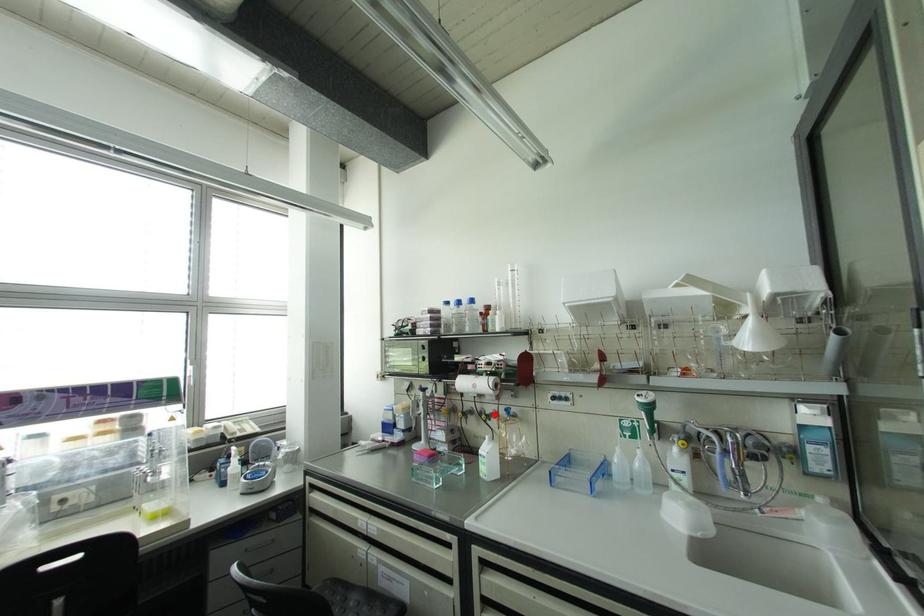
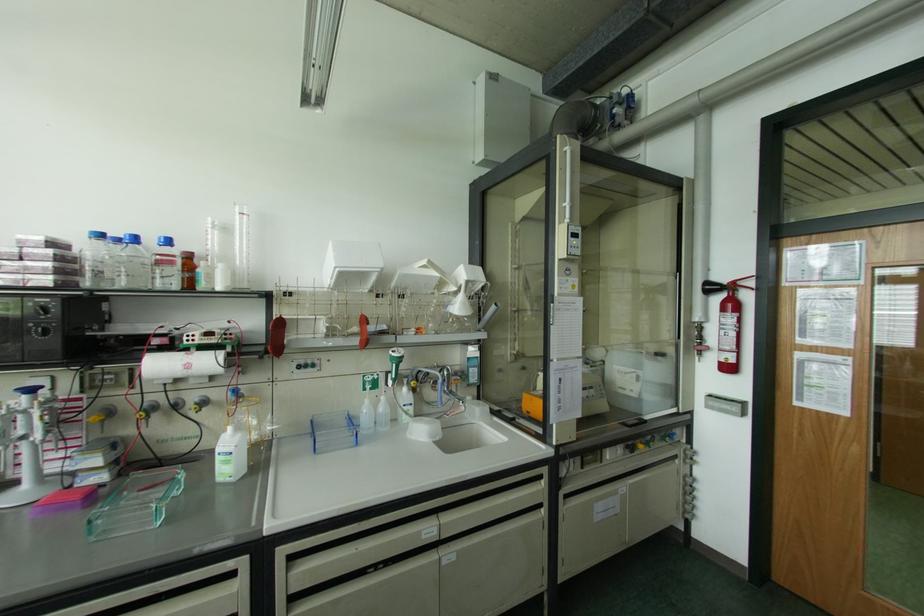
Question: I am providing you with two images of the same scene from different viewpoints. A red point is marked on the first image. Is the red point's position out of view in image 2?

Choices:
 (A) Yes
 (B) No

Answer: (B)